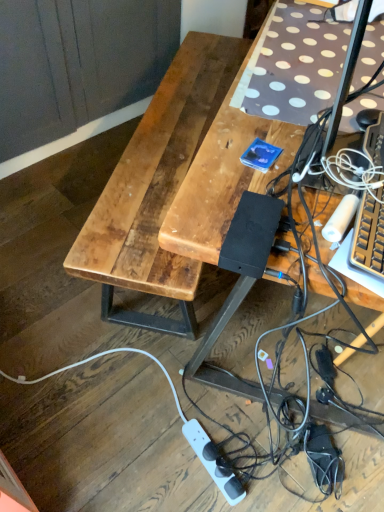
Question: Considering the relative positions of wooden desk at center and white plastic power strip at lower center in the image provided, is wooden desk at center to the left or to the right of white plastic power strip at lower center?

Choices:
 (A) right
 (B) left

Answer: (A)

Question: Looking at their shapes, would you say wooden desk at center is wider or thinner than white plastic power strip at lower center?

Choices:
 (A) wide
 (B) thin

Answer: (A)

Question: Considering the positions of wooden desk at center and white plastic power strip at lower center in the image, is wooden desk at center taller or shorter than white plastic power strip at lower center?

Choices:
 (A) tall
 (B) short

Answer: (A)

Question: In the image, is white plastic power strip at lower center positioned in front of or behind wooden desk at center?

Choices:
 (A) behind
 (B) front

Answer: (A)

Question: In terms of size, does white plastic power strip at lower center appear bigger or smaller than wooden desk at center?

Choices:
 (A) big
 (B) small

Answer: (B)

Question: Do you think white plastic power strip at lower center is within wooden desk at center, or outside of it?

Choices:
 (A) outside
 (B) inside

Answer: (A)

Question: Considering the positions of white plastic power strip at lower center and wooden desk at center in the image, is white plastic power strip at lower center wider or thinner than wooden desk at center?

Choices:
 (A) wide
 (B) thin

Answer: (B)